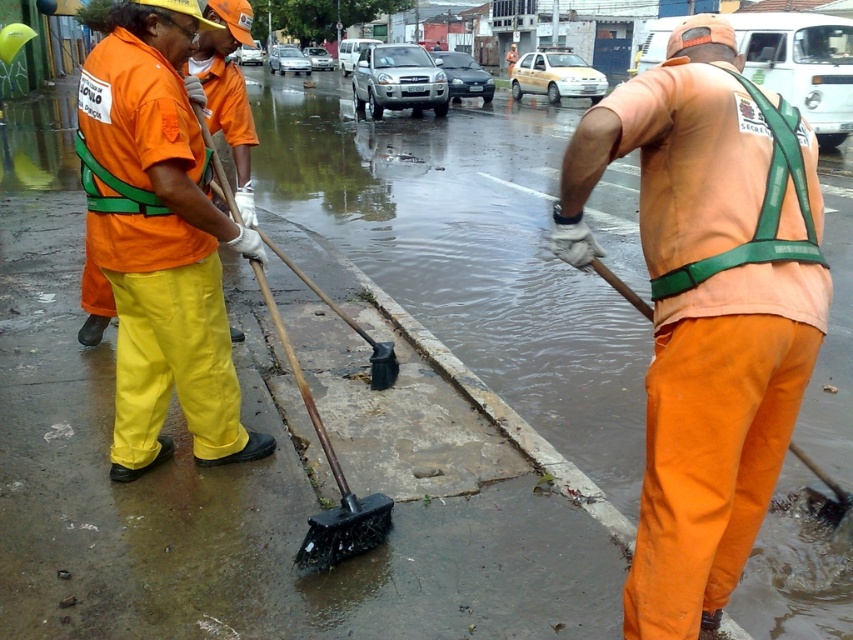
You are a delivery robot with a height of 1.5 meters. You need to navigate through the flooded area shown in the image. The wet concrete sidewalk at lower center is your destination. Considering the water depth and the camera distance provided, can you safely reach the sidewalk without getting wet?

The distance between the wet concrete sidewalk at lower center and the camera is 2.64 meters. However, the water depth isn not specified in the provided information. Therefore, it is impossible to determine if the delivery robot can safely reach the sidewalk without getting wet based solely on the given data.

You are a delivery robot with a 1.5 meter wide package. You need to pass between the orange matte shirt at center and the matte orange shirt at center. Can you fit through the space between them?

The orange matte shirt at center and the matte orange shirt at center are 1.61 meters apart from each other, so yes, the delivery robot with a 1.5 meter wide package can fit through the space between them since the gap is wider than the package.